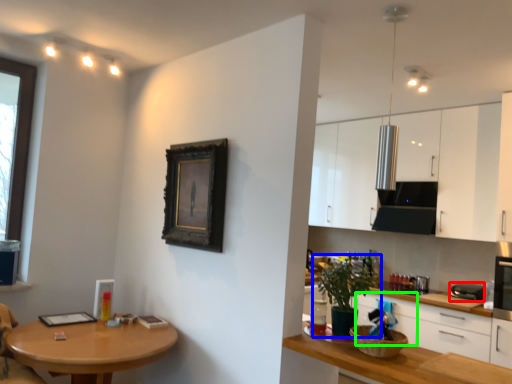
Question: Based on their relative distances, which object is farther from appliance (highlighted by a red box)? Choose from houseplant (highlighted by a blue box) and drawer (highlighted by a green box).

Choices:
 (A) houseplant
 (B) drawer

Answer: (A)